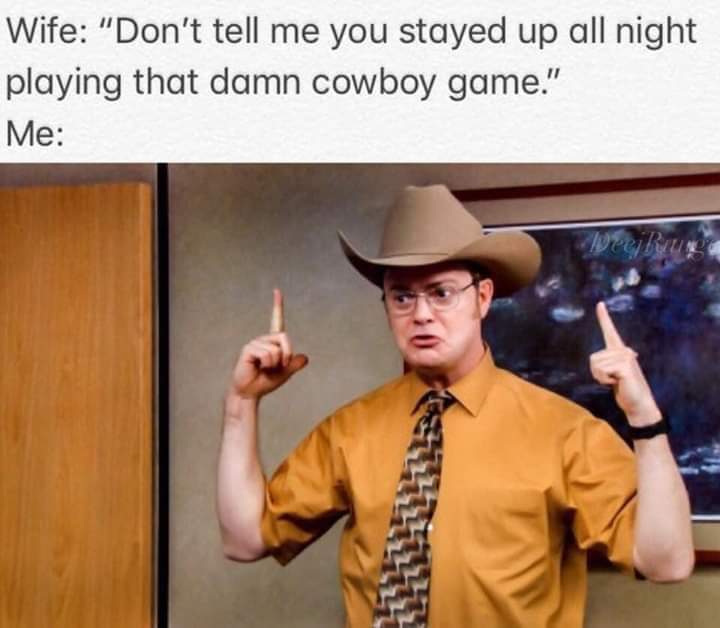
Where is `black vertical line on wall`? This screenshot has height=628, width=720. black vertical line on wall is located at coordinates (166, 257).